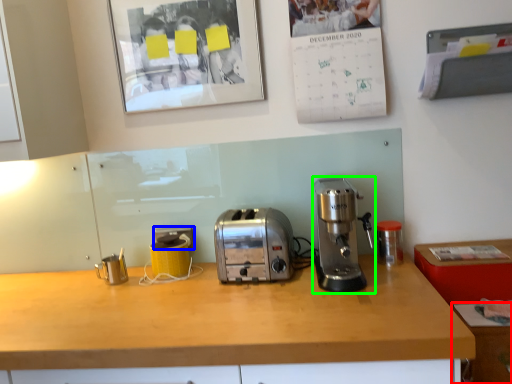
Question: Considering the real-world distances, which object is farthest from cabinetry (highlighted by a red box)? electric outlet (highlighted by a blue box) or coffee maker (highlighted by a green box)?

Choices:
 (A) electric outlet
 (B) coffee maker

Answer: (A)